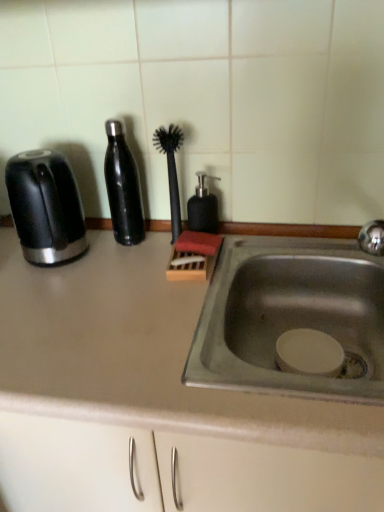
Where is `spots to the right of satin black bottle at center left`? This screenshot has width=384, height=512. spots to the right of satin black bottle at center left is located at coordinates (172, 250).